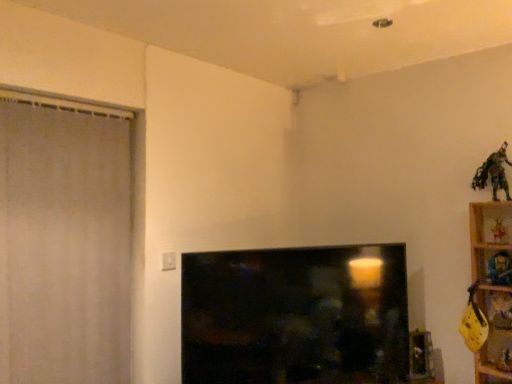
Question: Is plush fabric toy at upper right, positioned as the fourth toy in top-to-bottom order, positioned before metallic green figure at upper right, arranged as the 1th toy when viewed from the top?

Choices:
 (A) yes
 (B) no

Answer: (B)

Question: Is plush fabric toy at upper right, positioned as the fourth toy in top-to-bottom order, oriented towards metallic green figure at upper right, which is the sixth toy in bottom-to-top order?

Choices:
 (A) yes
 (B) no

Answer: (B)

Question: From the image's perspective, is plush fabric toy at upper right, positioned as the fourth toy in top-to-bottom order, on top of metallic green figure at upper right, arranged as the 1th toy when viewed from the top?

Choices:
 (A) no
 (B) yes

Answer: (A)

Question: Is plush fabric toy at upper right, placed as the 3th toy when sorted from bottom to top, at the right side of metallic green figure at upper right, which is the sixth toy in bottom-to-top order?

Choices:
 (A) no
 (B) yes

Answer: (B)

Question: Does plush fabric toy at upper right, placed as the 3th toy when sorted from bottom to top, appear on the left side of metallic green figure at upper right, arranged as the 1th toy when viewed from the top?

Choices:
 (A) yes
 (B) no

Answer: (B)

Question: Does plush fabric toy at upper right, positioned as the fourth toy in top-to-bottom order, have a lesser width compared to metallic green figure at upper right, which is the sixth toy in bottom-to-top order?

Choices:
 (A) no
 (B) yes

Answer: (B)

Question: From the image's perspective, is plush fabric toy at upper right, positioned as the fourth toy in top-to-bottom order, under black glossy tv at center?

Choices:
 (A) no
 (B) yes

Answer: (A)

Question: Is plush fabric toy at upper right, placed as the 3th toy when sorted from bottom to top, located outside black glossy tv at center?

Choices:
 (A) yes
 (B) no

Answer: (A)

Question: Does plush fabric toy at upper right, positioned as the fourth toy in top-to-bottom order, have a greater height compared to black glossy tv at center?

Choices:
 (A) yes
 (B) no

Answer: (B)

Question: Considering the relative positions of plush fabric toy at upper right, placed as the 3th toy when sorted from bottom to top, and black glossy tv at center in the image provided, is plush fabric toy at upper right, placed as the 3th toy when sorted from bottom to top, to the right of black glossy tv at center from the viewer's perspective?

Choices:
 (A) yes
 (B) no

Answer: (A)

Question: From the image's perspective, is plush fabric toy at upper right, positioned as the fourth toy in top-to-bottom order, on top of black glossy tv at center?

Choices:
 (A) yes
 (B) no

Answer: (A)

Question: Does wooden shelf at right lie behind wooden toy at upper right, which is the fifth toy in bottom-to-top order?

Choices:
 (A) no
 (B) yes

Answer: (A)